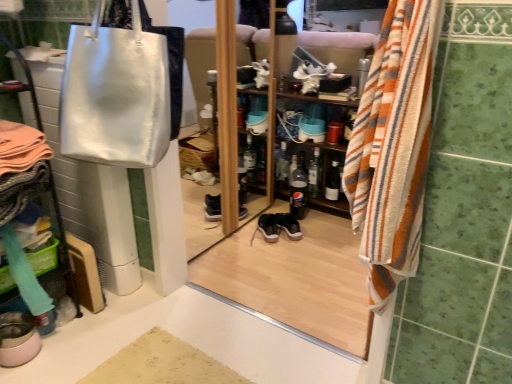
Question: From a real-world perspective, is matte silver bag at upper left positioned above or below matte black sneakers at center, the 2th footwear from the front?

Choices:
 (A) below
 (B) above

Answer: (B)

Question: Is matte silver bag at upper left in front of or behind matte black sneakers at center, acting as the 1th footwear starting from the back, in the image?

Choices:
 (A) behind
 (B) front

Answer: (B)

Question: Which object is the farthest from the translucent plastic bottle at center, the 3th bottle from the right?

Choices:
 (A) beige textured bath mat at lower center
 (B) black glass bottle at center, the fourth bottle when ordered from left to right
 (C) shiny silver bag at upper left
 (D) black suede shoe at center
 (E) wooden shelf at center

Answer: (C)

Question: Based on their relative distances, which object is nearer to the translucent plastic bottle at center, the 3th bottle from the right?

Choices:
 (A) matte silver bag at upper left
 (B) metallic silver bowl at lower left, the first footwear ordered from the bottom
 (C) clear glass bottle at center, placed as the fourth bottle when sorted from right to left
 (D) black suede shoe at center
 (E) striped cotton towel at right

Answer: (C)